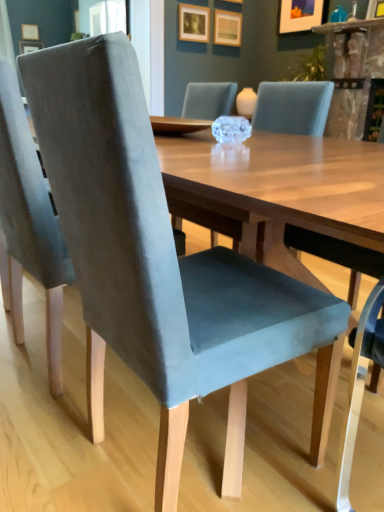
Question: Should I look upward or downward to see velvet blue chair at left?

Choices:
 (A) up
 (B) down

Answer: (A)